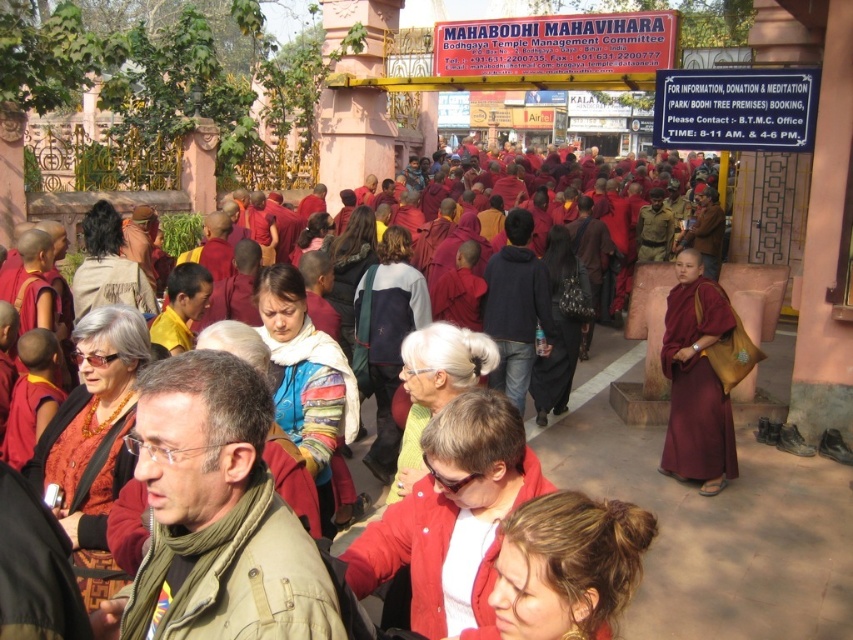
Does brown woolen scarf at center have a greater width compared to matte maroon robe at center?

No, brown woolen scarf at center is not wider than matte maroon robe at center.

Is brown woolen scarf at center smaller than matte maroon robe at center?

Correct, brown woolen scarf at center occupies less space than matte maroon robe at center.

Is point (236, 611) more distant than point (90, 244)?

No.

In order to click on brown woolen scarf at center in this screenshot , I will do `click(215, 516)`.

Who is lower down, maroon silk robe at right or matte orange robe at center?

maroon silk robe at right is lower down.

Can you confirm if maroon silk robe at right is positioned above matte orange robe at center?

No.

Locate an element on the screen. The width and height of the screenshot is (853, 640). maroon silk robe at right is located at coordinates (695, 387).

The image size is (853, 640). What are the coordinates of `maroon silk robe at right` in the screenshot? It's located at (695, 387).

Who is higher up, brown woolen scarf at center or matte orange robe at center?

brown woolen scarf at center is above.

Between point (171, 576) and point (129, 474), which one is positioned behind?

The point (129, 474) is more distant.

Is point (213, 436) closer to camera compared to point (49, 426)?

Yes, point (213, 436) is in front of point (49, 426).

At what (x,y) coordinates should I click in order to perform the action: click on brown woolen scarf at center. Please return your answer as a coordinate pair (x, y). Looking at the image, I should click on (215, 516).